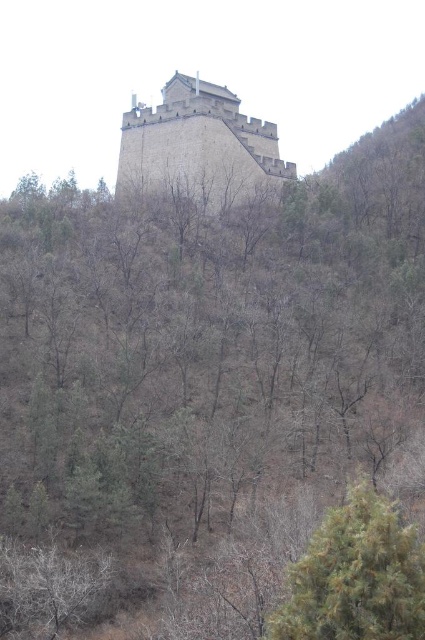
You are a hiker who wants to take a photo of the gray stone tower at center and the green textured tree at lower right. Which object should you move closer to in order to capture both in a single frame without zooming in?

You should move closer to the green textured tree at lower right because its width is smaller than the gray stone tower at center, allowing it to fit into the frame more easily when positioned closer.

You are standing on the Great Wall of China and see two points marked on the wall. The first point is at coordinate point (320, 563) and the second is at point (184, 180). Which point is closer to you if you are facing the wall?

Point (320, 563) is in front of point (184, 180), so the first point is closer to you.

You are a tourist visiting the Great Wall and want to take a photo that includes both the green textured tree at lower right and the gray stone tower at center. Based on their sizes in the image, which object should you focus on to ensure both are visible in the frame?

The green textured tree at lower right occupies less space than the gray stone tower at center. To ensure both are visible in the frame, focus on the gray stone tower at center since it is larger and will be easier to include fully while the smaller tree can be positioned within the same shot.